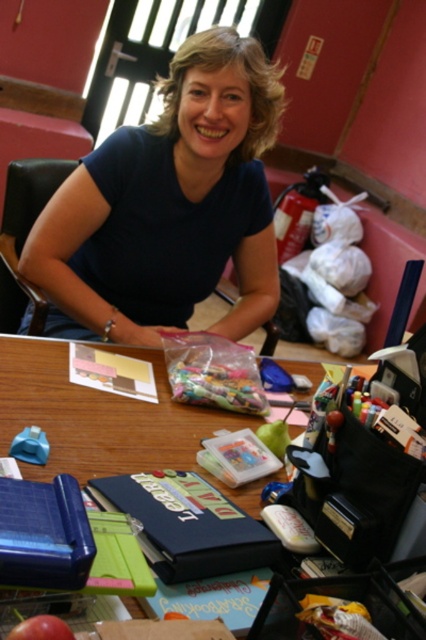
Can you confirm if blue matte shirt at center is thinner than wooden table at center?

Incorrect, blue matte shirt at center's width is not less than wooden table at center's.

Does blue matte shirt at center lie behind wooden table at center?

Yes, blue matte shirt at center is behind wooden table at center.

Between point (236, 252) and point (48, 378), which one is positioned behind?

The point (236, 252) is more distant.

Where is `blue matte shirt at center`? The height and width of the screenshot is (640, 426). blue matte shirt at center is located at coordinates (169, 205).